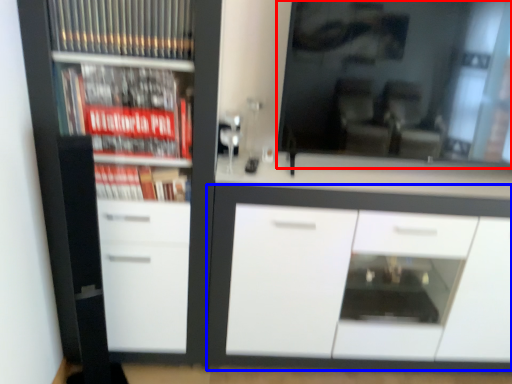
Question: Which object appears closest to the camera in this image, mirror (highlighted by a red box) or cabinetry (highlighted by a blue box)?

Choices:
 (A) mirror
 (B) cabinetry

Answer: (A)